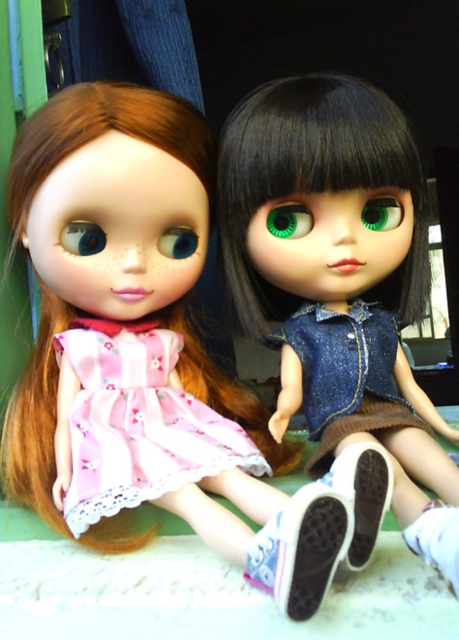
Identify the location of pink fabric dress at center. (145, 333).

The height and width of the screenshot is (640, 459). What do you see at coordinates (145, 333) in the screenshot? I see `pink fabric dress at center` at bounding box center [145, 333].

The width and height of the screenshot is (459, 640). I want to click on pink fabric dress at center, so click(145, 333).

The height and width of the screenshot is (640, 459). What are the coordinates of `pink fabric dress at center` in the screenshot? It's located at (145, 333).

Is point (359, 380) positioned after point (324, 534)?

That is True.

Between denim fabric dress at center and white canvas shoe at lower center, which one is positioned lower?

white canvas shoe at lower center

Where is `denim fabric dress at center`? denim fabric dress at center is located at coordinates (347, 374).

Consider the image. Is pink fabric dress at center taller than denim jacket at center?

No.

Between point (111, 250) and point (401, 378), which one is positioned behind?

The point (401, 378) is behind.

Find the location of a particular element. This screenshot has width=459, height=640. pink fabric dress at center is located at coordinates (145, 333).

Identify the location of pink fabric dress at center. This screenshot has height=640, width=459. (145, 333).